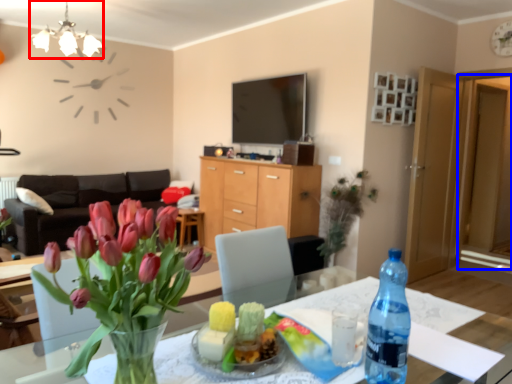
Question: Which of the following is the closest to the observer, light fixture (highlighted by a red box) or glass door (highlighted by a blue box)?

Choices:
 (A) light fixture
 (B) glass door

Answer: (A)